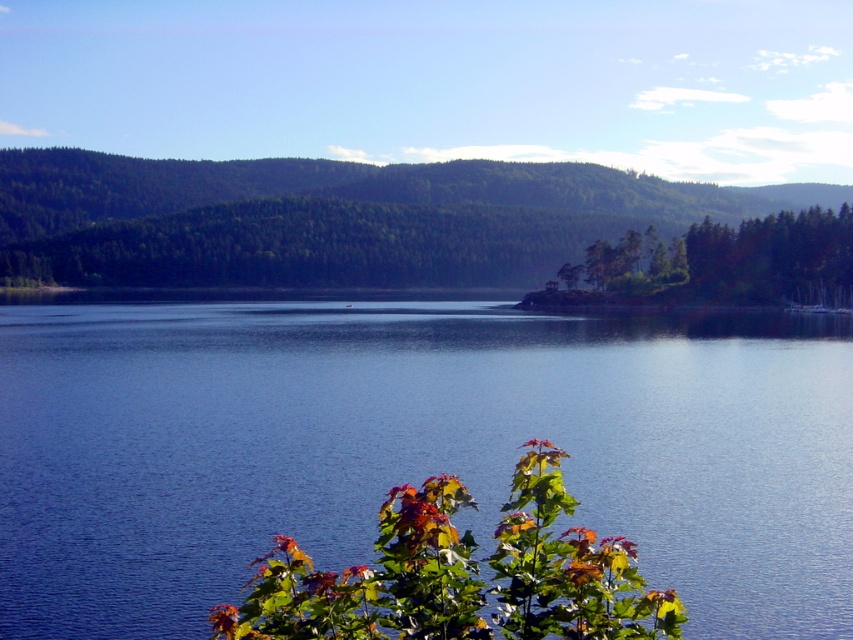
Question: Which point is closer to the camera?

Choices:
 (A) (828, 225)
 (B) (294, 570)
 (C) (196, 374)
 (D) (16, 152)

Answer: (B)

Question: Is green forested mountain at upper left to the left of green matte tree at center-right from the viewer's perspective?

Choices:
 (A) no
 (B) yes

Answer: (B)

Question: Among these objects, which one is farthest from the camera?

Choices:
 (A) green matte tree at center-right
 (B) green forested mountain at upper left

Answer: (B)

Question: Which of the following is the closest to the observer?

Choices:
 (A) (450, 259)
 (B) (834, 260)
 (C) (830, 452)

Answer: (C)

Question: Is green forested mountain at upper left smaller than green matte tree at center-right?

Choices:
 (A) yes
 (B) no

Answer: (B)

Question: Is blue water at center below green matte tree at center-right?

Choices:
 (A) yes
 (B) no

Answer: (A)